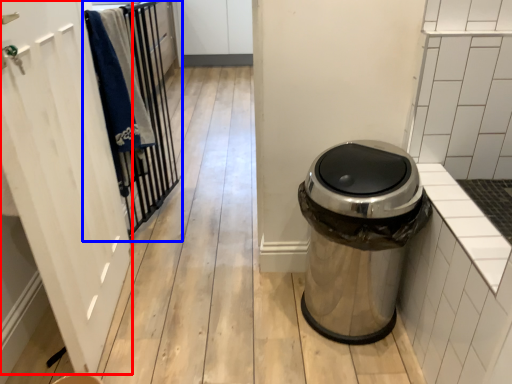
Question: Which object appears farthest to the camera in this image, screen door (highlighted by a red box) or closet (highlighted by a blue box)?

Choices:
 (A) screen door
 (B) closet

Answer: (B)